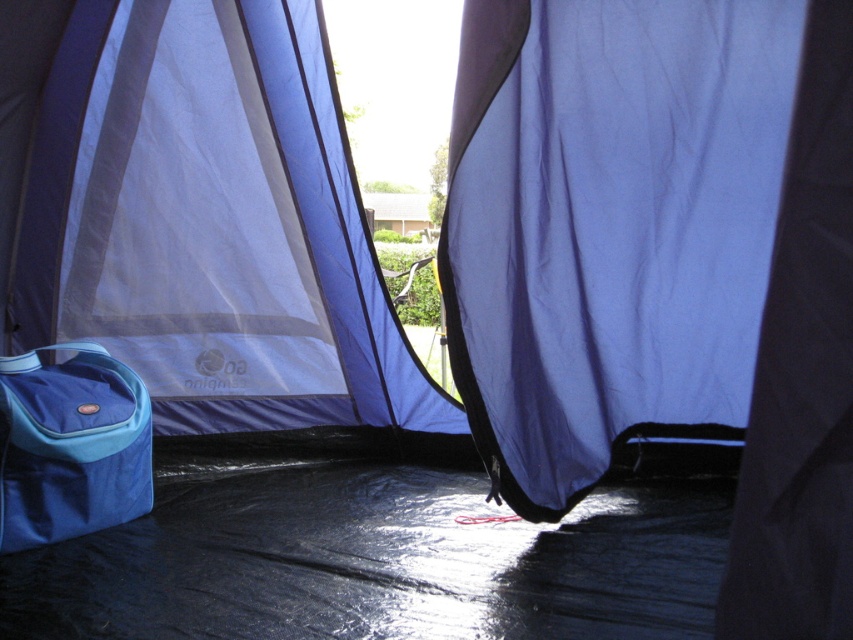
Question: Is blue fabric canopy at center below blue fabric curtain at center?

Choices:
 (A) yes
 (B) no

Answer: (A)

Question: Which point is closer to the camera taking this photo?

Choices:
 (A) coord(550,6)
 (B) coord(326,339)

Answer: (A)

Question: Which of the following is the closest to the observer?

Choices:
 (A) (107, 378)
 (B) (227, 113)

Answer: (A)

Question: Which point appears farthest from the camera in this image?

Choices:
 (A) (724, 412)
 (B) (339, 216)
 (C) (47, 378)

Answer: (B)

Question: Is blue fabric curtain at center wider than blue fabric bag at lower left?

Choices:
 (A) yes
 (B) no

Answer: (A)

Question: Is blue fabric canopy at center below blue fabric curtain at center?

Choices:
 (A) no
 (B) yes

Answer: (B)